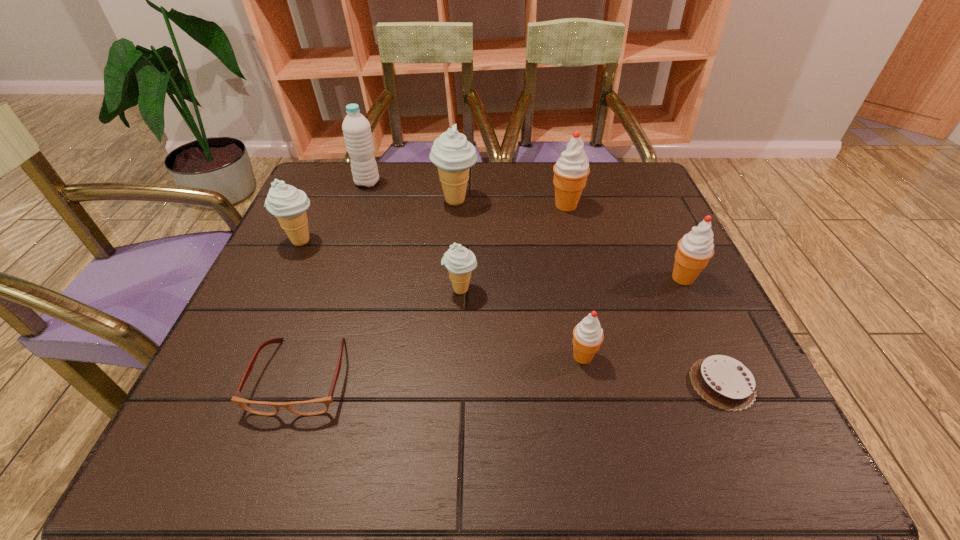
This screenshot has height=540, width=960. What are the coordinates of `object at the near left corner` in the screenshot? It's located at (317, 406).

In the image, there is a desktop. At what (x,y) coordinates should I click in order to perform the action: click on vacant space at the far edge. Please return your answer as a coordinate pair (x, y). The width and height of the screenshot is (960, 540). Looking at the image, I should click on (420, 177).

Locate an element on the screen. The width and height of the screenshot is (960, 540). free space at the near edge of the desktop is located at coordinates (660, 427).

At what (x,y) coordinates should I click in order to perform the action: click on vacant region at the left edge of the desktop. Please return your answer as a coordinate pair (x, y). The width and height of the screenshot is (960, 540). Looking at the image, I should click on (297, 391).

You are a GUI agent. You are given a task and a screenshot of the screen. Output one action in this format:
    pyautogui.click(x=<x>, y=<y>)
    Task: Click on the free spot at the right edge of the desktop
    The image size is (960, 540).
    Given the screenshot: What is the action you would take?
    pyautogui.click(x=685, y=376)

The image size is (960, 540). I want to click on free point at the far left corner, so click(x=311, y=189).

This screenshot has height=540, width=960. In the image, there is a desktop. Find the location of `vacant space at the far right corner`. vacant space at the far right corner is located at coordinates (601, 192).

I want to click on empty space that is in between the fourth farthest object and the white water bottle, so point(334,212).

The image size is (960, 540). Identify the location of empty space that is in between the nearest red icecream and the smallest beige icecream. (521, 323).

Find the location of a particular element. This screenshot has width=960, height=540. vacant space that is in between the white water bottle and the shortest object is located at coordinates (544, 283).